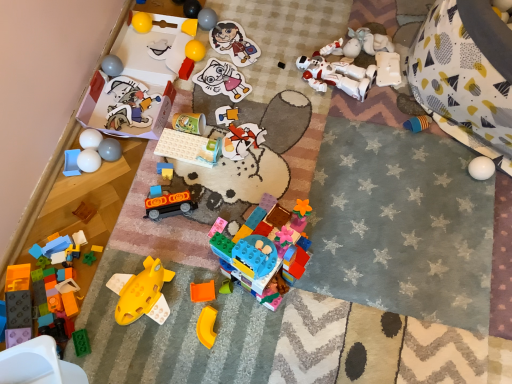
The height and width of the screenshot is (384, 512). Find the location of `free space that is in between white matte robot at center, which is counted as the 21th toy, starting from the left, and orange matte toy airplane at center, which is the eighth toy from right to left`. free space that is in between white matte robot at center, which is counted as the 21th toy, starting from the left, and orange matte toy airplane at center, which is the eighth toy from right to left is located at coordinates (291, 152).